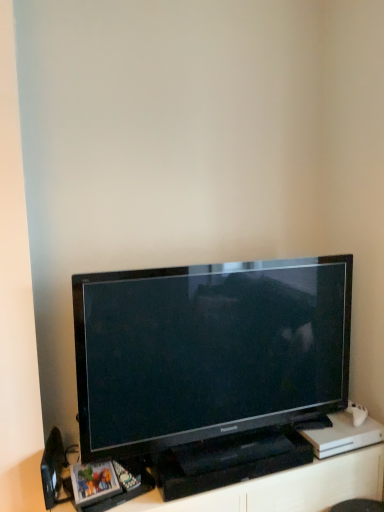
Question: Is black plastic entertainment center at lower center oriented towards black glossy television at center?

Choices:
 (A) yes
 (B) no

Answer: (B)

Question: Would you say black glossy television at center is part of black plastic entertainment center at lower center's contents?

Choices:
 (A) yes
 (B) no

Answer: (B)

Question: Considering the relative positions of black plastic entertainment center at lower center and black glossy television at center in the image provided, is black plastic entertainment center at lower center in front of black glossy television at center?

Choices:
 (A) no
 (B) yes

Answer: (A)

Question: From the image's perspective, is black plastic entertainment center at lower center under black glossy television at center?

Choices:
 (A) no
 (B) yes

Answer: (B)

Question: From a real-world perspective, is black plastic entertainment center at lower center under black glossy television at center?

Choices:
 (A) yes
 (B) no

Answer: (A)

Question: Considering the relative positions of black plastic entertainment center at lower center and black glossy television at center in the image provided, is black plastic entertainment center at lower center to the right of black glossy television at center from the viewer's perspective?

Choices:
 (A) no
 (B) yes

Answer: (A)

Question: Is black plastic speaker at lower left positioned with its back to black glossy television at center?

Choices:
 (A) yes
 (B) no

Answer: (B)

Question: Is black plastic speaker at lower left with black glossy television at center?

Choices:
 (A) no
 (B) yes

Answer: (A)

Question: Is black plastic speaker at lower left to the right of black glossy television at center from the viewer's perspective?

Choices:
 (A) yes
 (B) no

Answer: (B)

Question: Considering the relative positions of black plastic speaker at lower left and black glossy television at center in the image provided, is black plastic speaker at lower left behind black glossy television at center?

Choices:
 (A) no
 (B) yes

Answer: (B)

Question: Is black plastic speaker at lower left positioned far away from black glossy television at center?

Choices:
 (A) yes
 (B) no

Answer: (B)

Question: From the image's perspective, does black plastic speaker at lower left appear lower than black glossy television at center?

Choices:
 (A) no
 (B) yes

Answer: (B)

Question: Can you confirm if black plastic speaker at lower left is thinner than black plastic entertainment center at lower center?

Choices:
 (A) no
 (B) yes

Answer: (B)